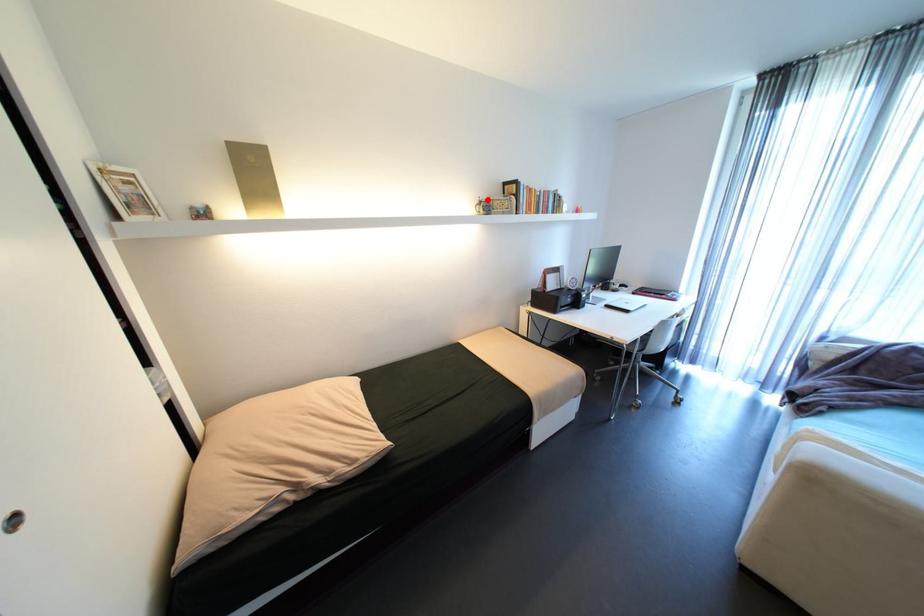
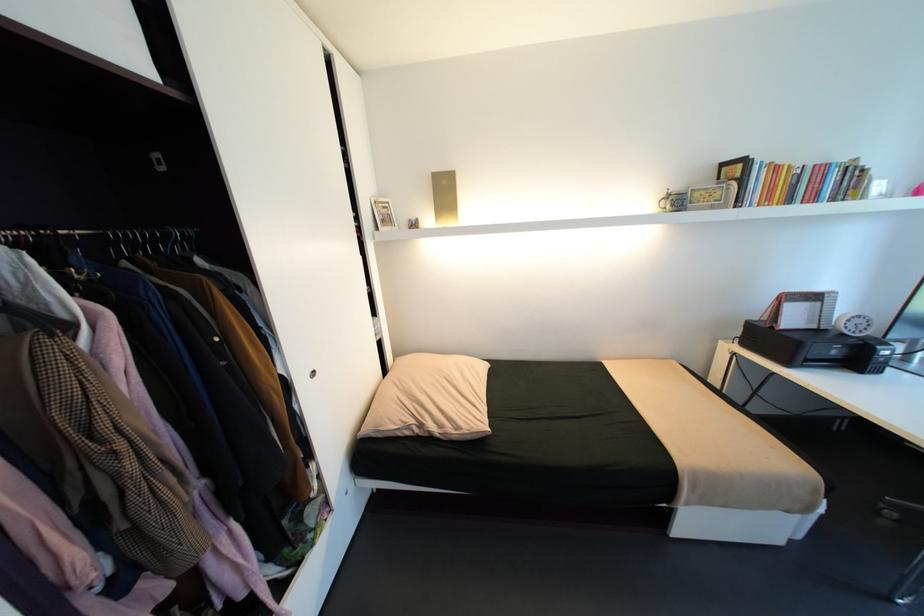
In the second image, find the point that corresponds to the highlighted location in the first image.

(676, 192)